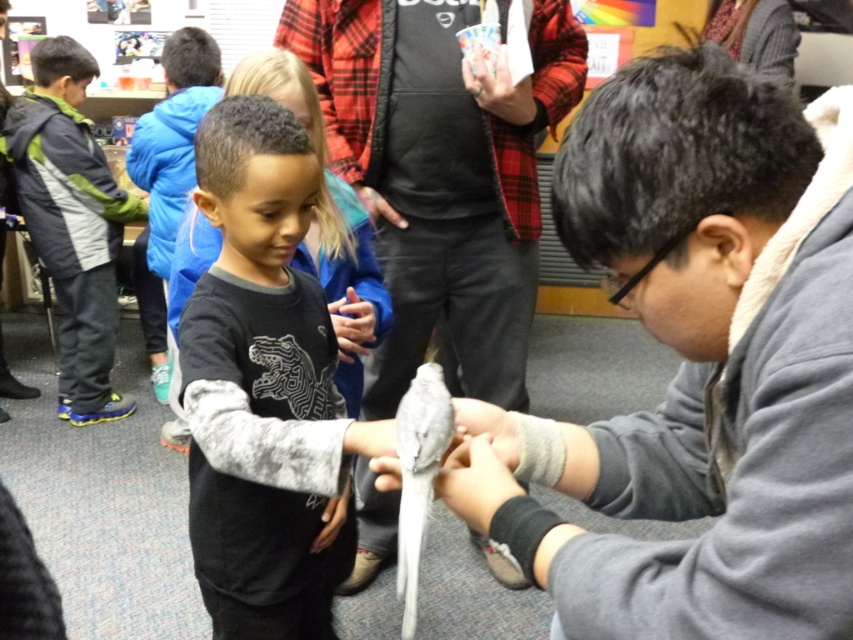
You are standing in the classroom and need to locate the flannel shirt at center. According to the coordinates provided, where would you find it?

The flannel shirt at center is located at the coordinates point (442, 176).